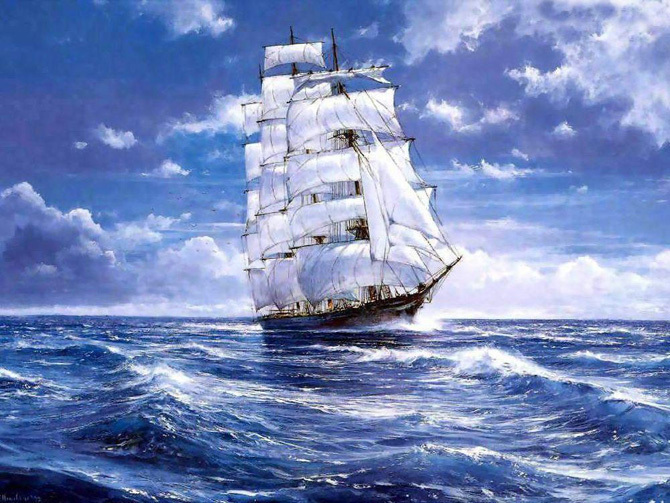
In order to click on top left corner empty space in this screenshot , I will do `click(639, 23)`.